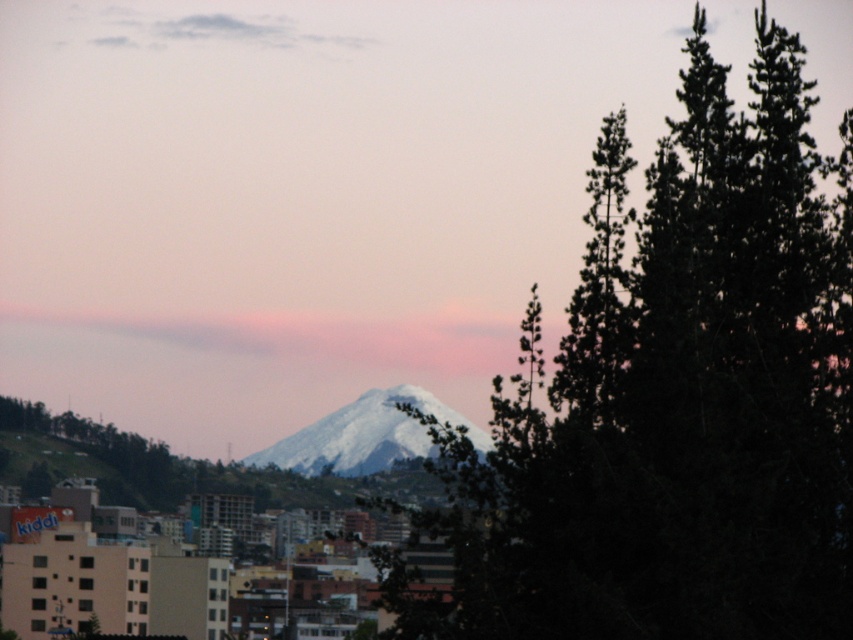
Question: Is dark green foliage at center to the right of white snow-covered peak at center from the viewer's perspective?

Choices:
 (A) yes
 (B) no

Answer: (A)

Question: Where is dark green foliage at center located in relation to white snow-covered peak at center in the image?

Choices:
 (A) right
 (B) left

Answer: (A)

Question: Among these points, which one is farthest from the camera?

Choices:
 (A) (398, 417)
 (B) (757, 186)

Answer: (A)

Question: Can you confirm if dark green foliage at center is positioned to the right of white snow-covered peak at center?

Choices:
 (A) no
 (B) yes

Answer: (B)

Question: Among these points, which one is nearest to the camera?

Choices:
 (A) (556, 506)
 (B) (252, 452)

Answer: (A)